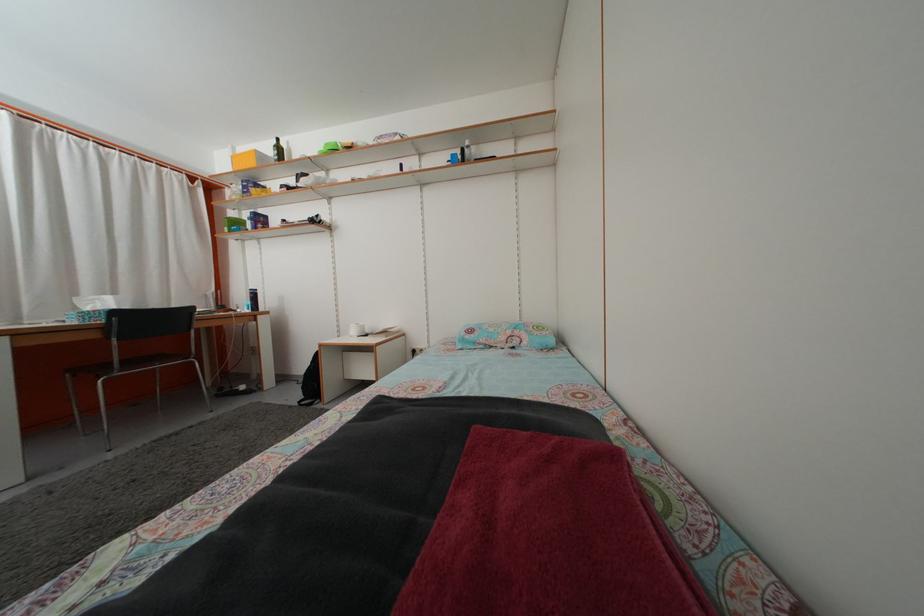
Find the location of a particular element. black backpack is located at coordinates (310, 383).